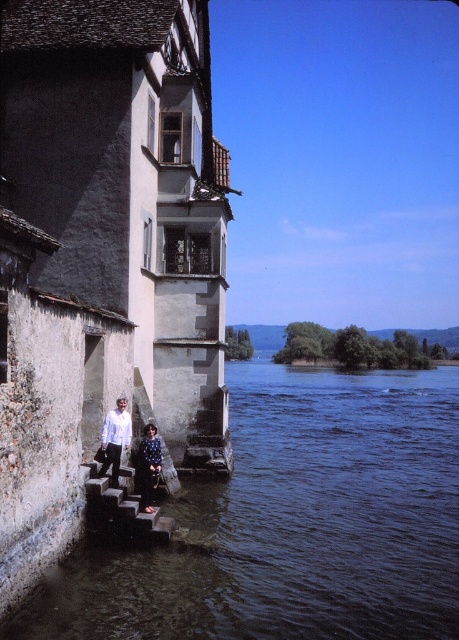
Question: Which is farther from the white matte shirt at lower left?

Choices:
 (A) dark blue water at lower center
 (B) dark blue dress at lower left

Answer: (A)

Question: Based on their relative distances, which object is nearer to the stone steps at lower left?

Choices:
 (A) dark blue dress at lower left
 (B) dark blue water at lower center
 (C) white matte shirt at lower left

Answer: (C)

Question: Does dark blue water at lower center have a larger size compared to white matte shirt at lower left?

Choices:
 (A) yes
 (B) no

Answer: (A)

Question: Does dark blue water at lower center have a lesser width compared to dark blue textured sweater at lower center?

Choices:
 (A) no
 (B) yes

Answer: (A)

Question: Among these points, which one is nearest to the camera?

Choices:
 (A) (139, 490)
 (B) (106, 416)

Answer: (B)

Question: Does dark blue water at lower center have a greater width compared to white matte shirt at lower left?

Choices:
 (A) yes
 (B) no

Answer: (A)